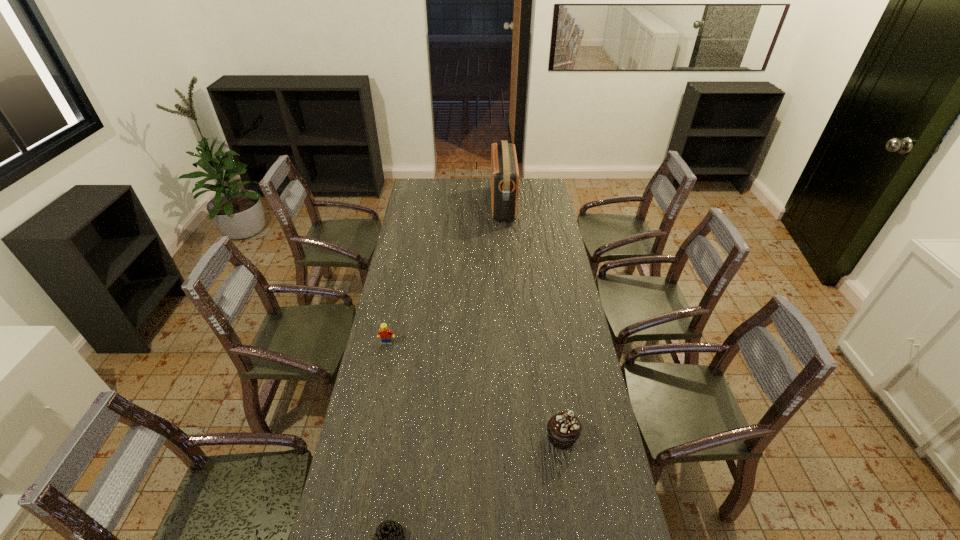
Where is `the third object from left to right`? The height and width of the screenshot is (540, 960). the third object from left to right is located at coordinates (504, 168).

The width and height of the screenshot is (960, 540). I want to click on the tallest object, so click(504, 168).

The height and width of the screenshot is (540, 960). Identify the location of the second nearest object. (564, 428).

This screenshot has width=960, height=540. What are the coordinates of `cupcake` in the screenshot? It's located at (564, 428).

You are a GUI agent. You are given a task and a screenshot of the screen. Output one action in this format:
    pyautogui.click(x=<x>, y=<y>)
    Task: Click on the leftmost object
    The image size is (960, 540).
    Given the screenshot: What is the action you would take?
    pyautogui.click(x=384, y=333)

Locate an element on the screen. The width and height of the screenshot is (960, 540). Lego is located at coordinates (384, 333).

Identify the location of free location located 0.090m on the front-facing side of the radio receiver. (475, 205).

The image size is (960, 540). Find the location of `free point located 0.150m on the front-facing side of the radio receiver`. free point located 0.150m on the front-facing side of the radio receiver is located at coordinates (465, 205).

The image size is (960, 540). What are the coordinates of `vacant space located 0.320m on the front-facing side of the radio receiver` in the screenshot? It's located at (434, 205).

Where is `vacant area situated on the front of the third farthest object`? The height and width of the screenshot is (540, 960). vacant area situated on the front of the third farthest object is located at coordinates (568, 478).